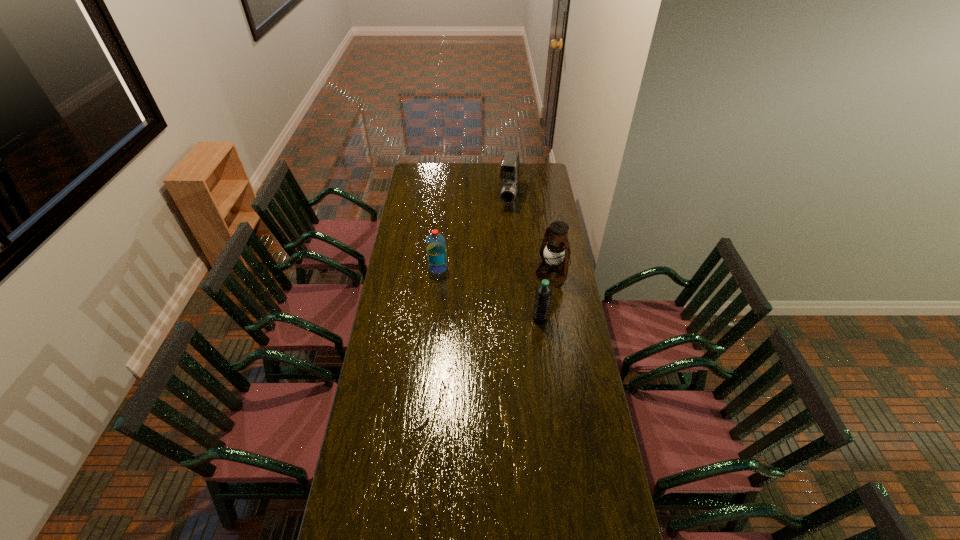
This screenshot has height=540, width=960. What are the coordinates of `vacant space on the desktop that is between the left water bottle and the nearest object and is positioned at the front of the second object from left to right, highlighting the lens` in the screenshot? It's located at (486, 292).

The width and height of the screenshot is (960, 540). I want to click on free space on the desktop that is between the leftmost object and the nearest object and is positioned on the side of the lantern, there is a wick adjustment knob, so [x=501, y=300].